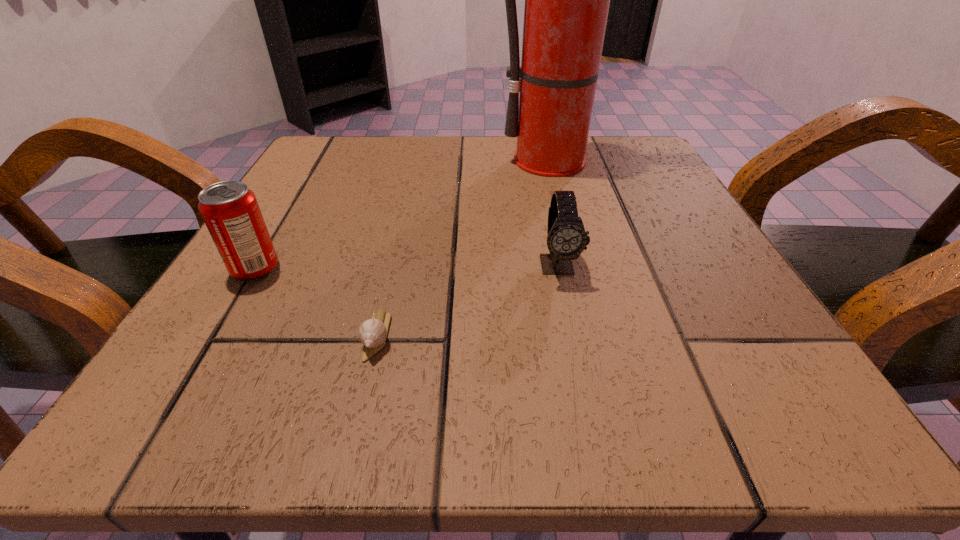
Where is `object at the near edge`? The width and height of the screenshot is (960, 540). object at the near edge is located at coordinates (372, 333).

I want to click on object situated at the left edge, so click(230, 210).

Locate an element on the screen. object at the right edge is located at coordinates (567, 0).

Locate an element on the screen. This screenshot has width=960, height=540. object at the far right corner is located at coordinates (567, 0).

You are a GUI agent. You are given a task and a screenshot of the screen. Output one action in this format:
    pyautogui.click(x=<x>, y=<y>)
    Task: Click on the free region at the far edge
    
    Given the screenshot: What is the action you would take?
    pyautogui.click(x=416, y=144)

Identify the location of vacant region at the near edge. (623, 411).

I want to click on free spot at the left edge of the desktop, so click(330, 205).

The width and height of the screenshot is (960, 540). In the image, there is a desktop. What are the coordinates of `vacant space at the right edge` in the screenshot? It's located at (624, 271).

Image resolution: width=960 pixels, height=540 pixels. In the image, there is a desktop. Identify the location of vacant region at the far left corner. (387, 142).

The height and width of the screenshot is (540, 960). I want to click on free space at the far right corner of the desktop, so click(628, 190).